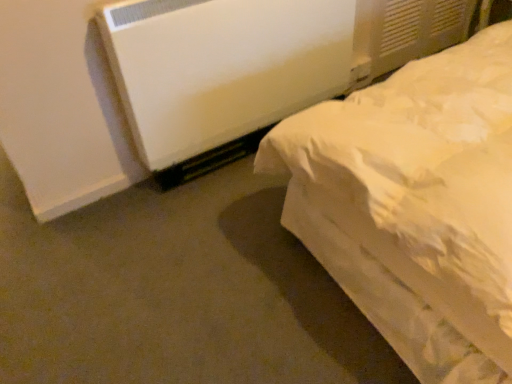
Describe the element at coordinates (415, 205) in the screenshot. The image size is (512, 384). I see `white soft bed at right` at that location.

Locate an element on the screen. Image resolution: width=512 pixels, height=384 pixels. white soft bed at right is located at coordinates (415, 205).

You are a GUI agent. You are given a task and a screenshot of the screen. Output one action in this format:
    pyautogui.click(x=<x>, y=<y>)
    Task: Click on the white soft bed at right
    Image resolution: width=512 pixels, height=384 pixels.
    Given the screenshot: What is the action you would take?
    pyautogui.click(x=415, y=205)